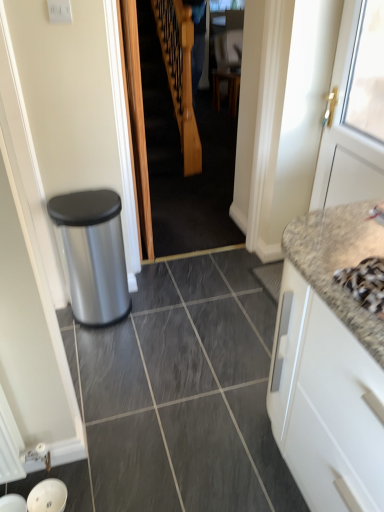
Question: Relative to white matte cabinet at right, is wooden staircase at center in front or behind?

Choices:
 (A) behind
 (B) front

Answer: (A)

Question: Is wooden staircase at center wider or thinner than white matte cabinet at right?

Choices:
 (A) wide
 (B) thin

Answer: (B)

Question: Estimate the real-world distances between objects in this image. Which object is farther from the silver metallic faucet at upper right?

Choices:
 (A) blue fabric at center
 (B) white matte cabinet at right
 (C) white painted wood door at right
 (D) granite at right
 (E) wooden staircase at center

Answer: (A)

Question: Which object is the closest to the granite at right?

Choices:
 (A) silver metallic faucet at upper right
 (B) wooden staircase at center
 (C) white painted wood door at right
 (D) blue fabric at center
 (E) white matte cabinet at right

Answer: (E)